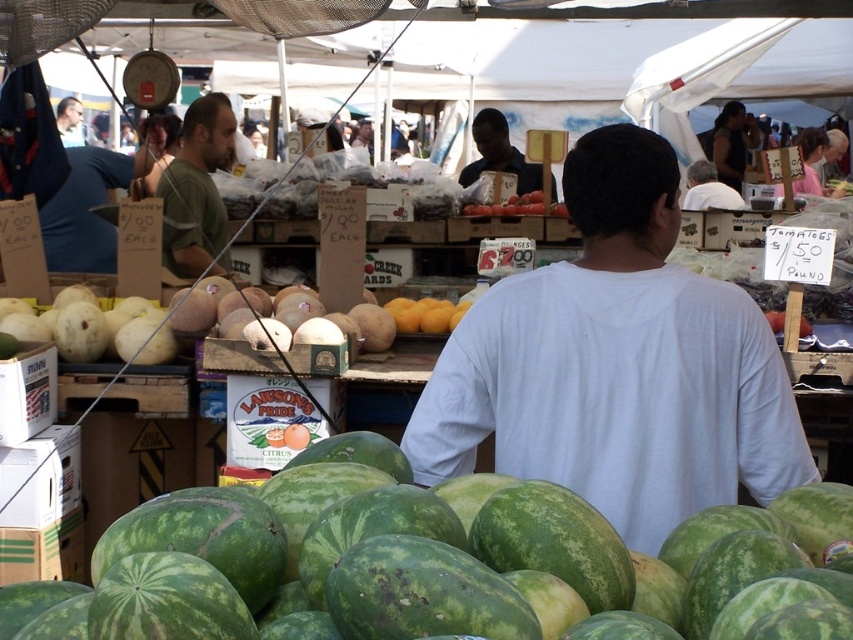
Question: Is white cotton shirt at upper center closer to camera compared to smooth red tomatoes at center?

Choices:
 (A) yes
 (B) no

Answer: (B)

Question: Does yellow matte peaches at center appear on the right side of white cotton shirt at upper center?

Choices:
 (A) yes
 (B) no

Answer: (B)

Question: Among these objects, which one is nearest to the camera?

Choices:
 (A) yellow matte peaches at center
 (B) green cotton shirt at center

Answer: (A)

Question: Which point is closer to the camera taking this photo?

Choices:
 (A) (399, 312)
 (B) (563, 508)

Answer: (B)

Question: Where is green striped water at center located in relation to white cotton shirt at center in the image?

Choices:
 (A) left
 (B) right

Answer: (A)

Question: Which object is the closest to the smooth black shirt at center?

Choices:
 (A) smooth red tomatoes at center
 (B) green striped water at center
 (C) white cotton shirt at upper center
 (D) white cotton shirt at center

Answer: (A)